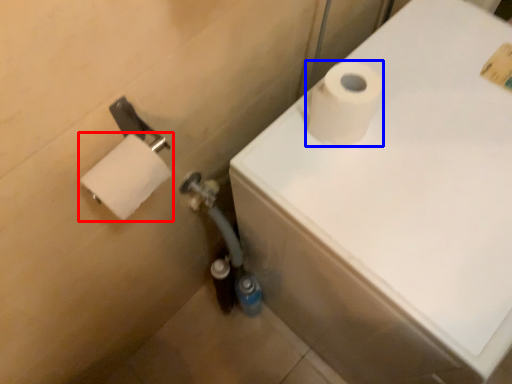
Question: Among these objects, which one is nearest to the camera, toilet paper (highlighted by a red box) or toilet paper (highlighted by a blue box)?

Choices:
 (A) toilet paper
 (B) toilet paper

Answer: (A)